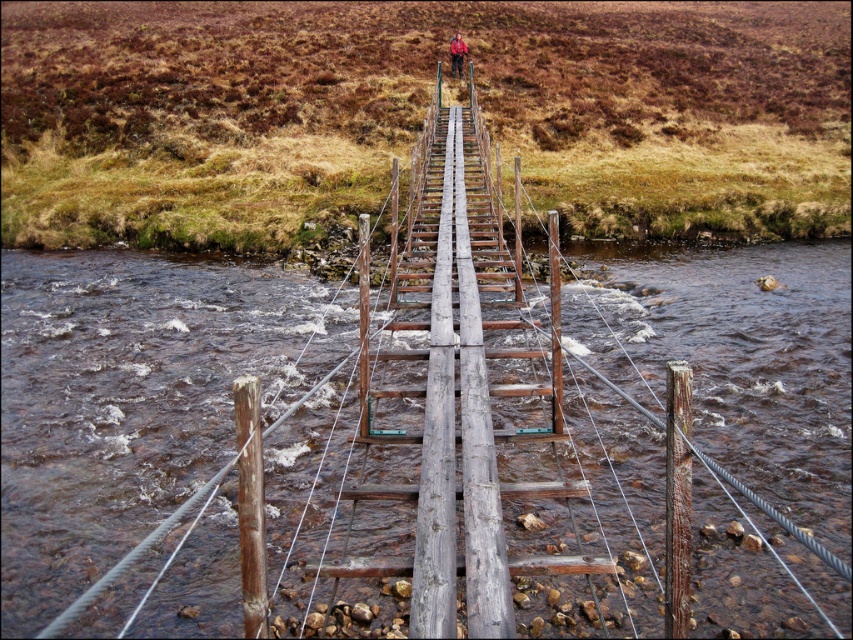
Between brown wooden bridge at center and red matte jacket at center, which one is positioned lower?

Positioned lower is brown wooden bridge at center.

Is brown wooden bridge at center to the right of red matte jacket at center from the viewer's perspective?

Incorrect, brown wooden bridge at center is not on the right side of red matte jacket at center.

This screenshot has height=640, width=853. I want to click on brown wooden bridge at center, so click(131, 397).